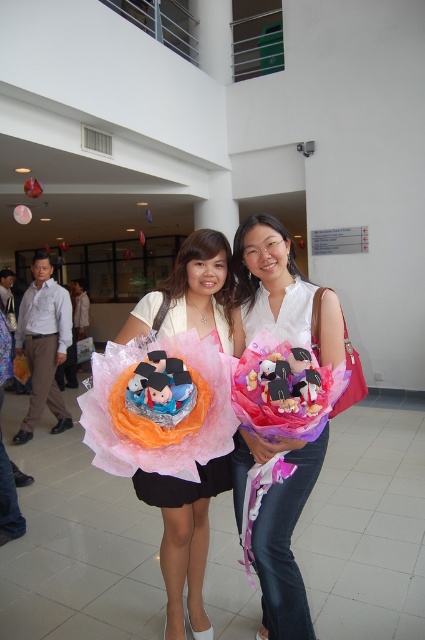
Question: Is white matte shirt at center bigger than matte pink fabric dress at center?

Choices:
 (A) yes
 (B) no

Answer: (A)

Question: Which of the following is the farthest from the observer?

Choices:
 (A) (328, 342)
 (B) (152, 291)
 (C) (150, 502)

Answer: (B)

Question: Which of these objects is positioned closest to the matte pink fabric at center?

Choices:
 (A) matte pink fabric dress at center
 (B) white matte shirt at center

Answer: (A)

Question: Does white matte shirt at center have a smaller size compared to matte pink fabric dress at center?

Choices:
 (A) no
 (B) yes

Answer: (A)

Question: Can you confirm if white matte shirt at center is positioned above matte pink fabric dress at center?

Choices:
 (A) yes
 (B) no

Answer: (B)

Question: Estimate the real-world distances between objects in this image. Which object is farther from the matte pink fabric at center?

Choices:
 (A) matte pink fabric dress at center
 (B) white matte shirt at center

Answer: (B)